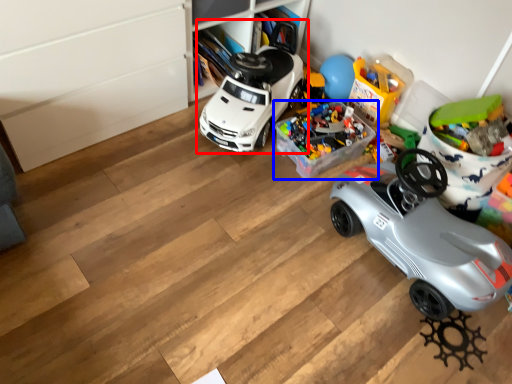
Question: Which object appears farthest to the camera in this image, car (highlighted by a red box) or toy (highlighted by a blue box)?

Choices:
 (A) car
 (B) toy

Answer: (B)